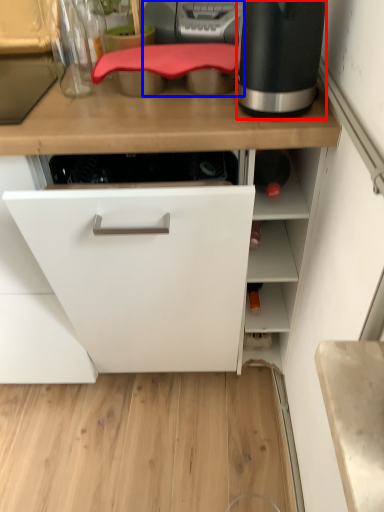
Question: Which of the following is the closest to the observer, home appliance (highlighted by a red box) or kitchen appliance (highlighted by a blue box)?

Choices:
 (A) home appliance
 (B) kitchen appliance

Answer: (A)